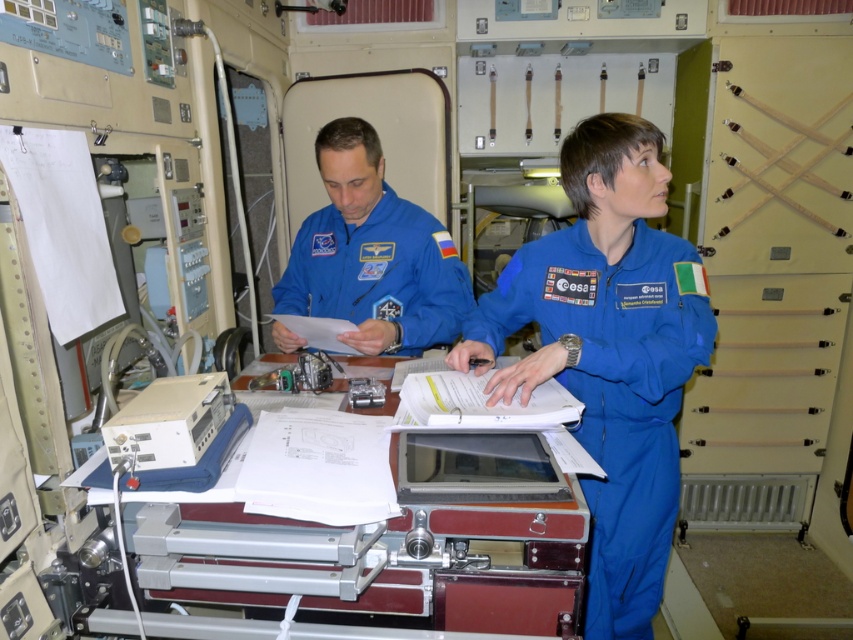
Does metallic silver printer at center come behind blue fabric astronaut suit at center?

No, metallic silver printer at center is in front of blue fabric astronaut suit at center.

Based on the photo, who is more distant from viewer, [393,525] or [305,300]?

Point [305,300]

Measure the distance between metallic silver printer at center and camera.

metallic silver printer at center is 37.17 inches from camera.

This screenshot has width=853, height=640. Find the location of `metallic silver printer at center`. metallic silver printer at center is located at coordinates (372, 557).

Can you confirm if blue smooth jumpsuit at center is shorter than blue fabric astronaut suit at center?

Incorrect, blue smooth jumpsuit at center's height does not fall short of blue fabric astronaut suit at center's.

Does blue smooth jumpsuit at center have a greater width compared to blue fabric astronaut suit at center?

No, blue smooth jumpsuit at center is not wider than blue fabric astronaut suit at center.

Describe the element at coordinates (608, 353) in the screenshot. Image resolution: width=853 pixels, height=640 pixels. I see `blue smooth jumpsuit at center` at that location.

The height and width of the screenshot is (640, 853). I want to click on blue smooth jumpsuit at center, so click(608, 353).

Is blue smooth jumpsuit at center shorter than metallic silver printer at center?

In fact, blue smooth jumpsuit at center may be taller than metallic silver printer at center.

Does point (489, 355) come farther from viewer compared to point (247, 568)?

Yes, point (489, 355) is behind point (247, 568).

The image size is (853, 640). In order to click on blue smooth jumpsuit at center in this screenshot , I will do `click(608, 353)`.